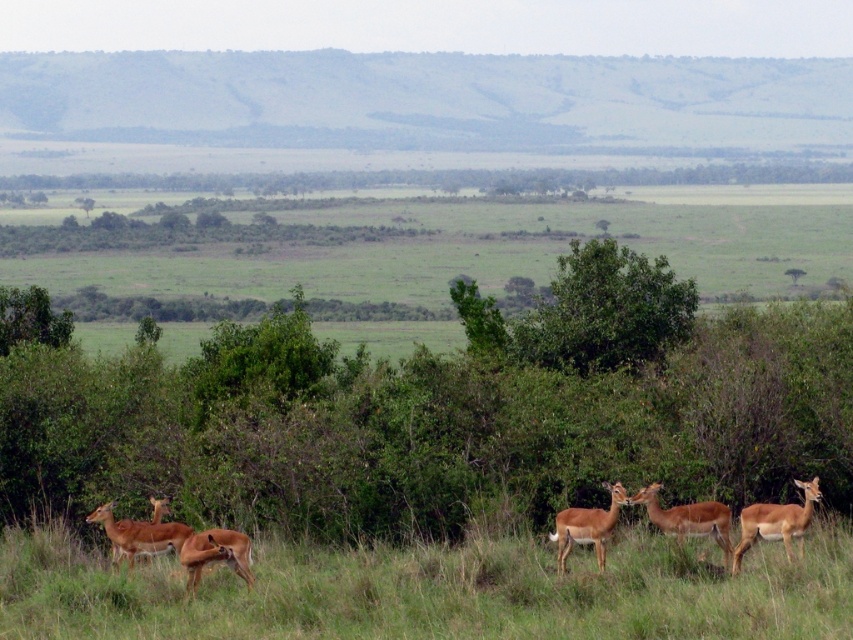
You are a safari guide leading a tour and want to point out the brown matte antelope at center to your guests. Since the green grass at center is in the way, can you see the antelope clearly?

The green grass at center is smaller than the brown matte antelope at center, so the grass is not blocking the view of the antelope. You can see the antelope clearly.

You are a photographer standing at the point labeled as point (434, 592) in the image. What is the primary color of the ground directly beneath your feet?

The point (434, 592) corresponds to green grass at center, so the primary color of the ground directly beneath your feet is green.